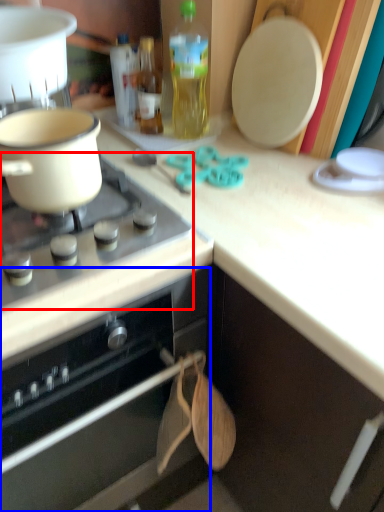
Question: Among these objects, which one is nearest to the camera, gas stove (highlighted by a red box) or oven (highlighted by a blue box)?

Choices:
 (A) gas stove
 (B) oven

Answer: (B)